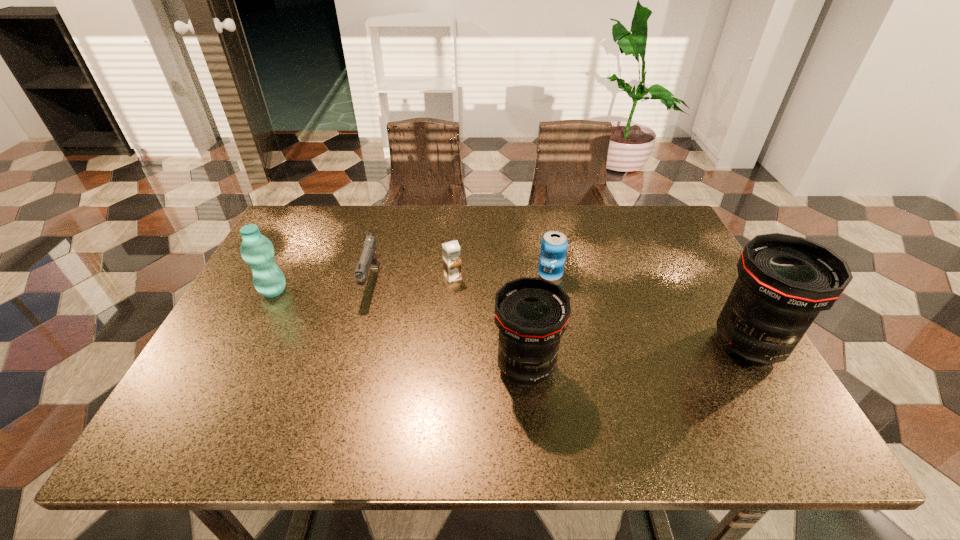
Identify the location of vacant place for an extra telephoto lens on the left. This screenshot has height=540, width=960. (279, 393).